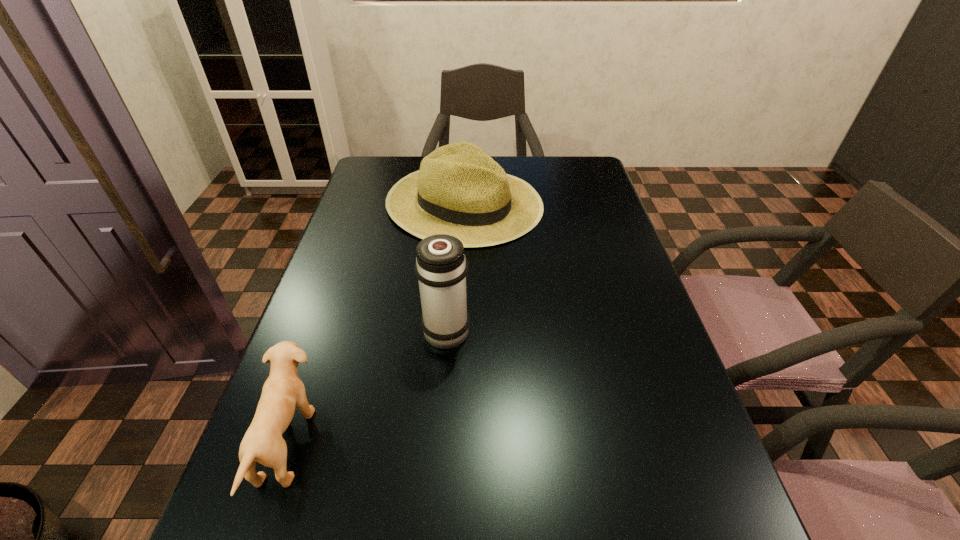
Where is `object that is at the far edge`? Image resolution: width=960 pixels, height=540 pixels. object that is at the far edge is located at coordinates (460, 190).

At what (x,y) coordinates should I click in order to perform the action: click on sunhat present at the left edge. Please return your answer as a coordinate pair (x, y). The height and width of the screenshot is (540, 960). Looking at the image, I should click on (460, 190).

You are a GUI agent. You are given a task and a screenshot of the screen. Output one action in this format:
    pyautogui.click(x=<x>, y=<y>)
    Task: Click on the puppy that is positioned at the left edge
    The image size is (960, 540).
    Given the screenshot: What is the action you would take?
    pyautogui.click(x=283, y=390)

In order to click on object situated at the far left corner in this screenshot , I will do `click(460, 190)`.

Where is `blank space at the far edge of the desktop`? The height and width of the screenshot is (540, 960). blank space at the far edge of the desktop is located at coordinates (515, 168).

Locate an element on the screen. This screenshot has width=960, height=540. free location at the left edge is located at coordinates (382, 230).

In the image, there is a desktop. Identify the location of vacant space at the right edge. (598, 251).

The width and height of the screenshot is (960, 540). Identify the location of free space between the farthest object and the nearest object. (376, 323).

Image resolution: width=960 pixels, height=540 pixels. What are the coordinates of `free area in between the leftmost object and the farthest object` in the screenshot? It's located at (376, 323).

At what (x,y) coordinates should I click in order to perform the action: click on free spot between the puppy and the thermos bottle. Please return your answer as a coordinate pair (x, y). This screenshot has width=960, height=540. Looking at the image, I should click on (367, 386).